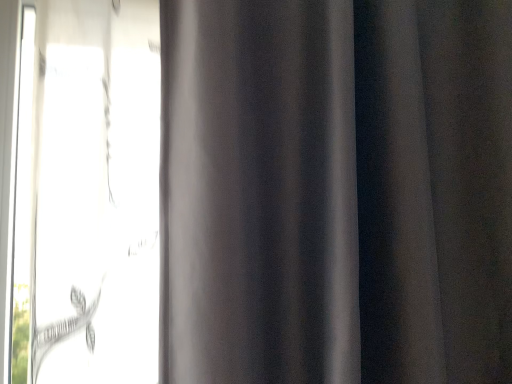
Locate an element on the screen. Image resolution: width=512 pixels, height=384 pixels. matte gray curtain at center is located at coordinates (336, 192).

The height and width of the screenshot is (384, 512). What do you see at coordinates (336, 192) in the screenshot?
I see `matte gray curtain at center` at bounding box center [336, 192].

You are a GUI agent. You are given a task and a screenshot of the screen. Output one action in this format:
    pyautogui.click(x=<x>, y=<y>)
    Task: Click on the matte gray curtain at center
    Image resolution: width=512 pixels, height=384 pixels.
    Given the screenshot: What is the action you would take?
    pyautogui.click(x=336, y=192)